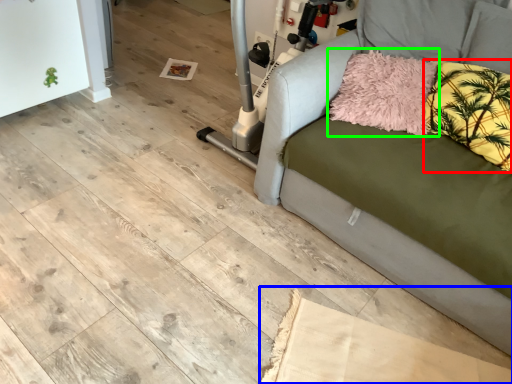
Question: Which is farther away from pillow (highlighted by a red box)? cardboard (highlighted by a blue box) or pillow (highlighted by a green box)?

Choices:
 (A) cardboard
 (B) pillow

Answer: (A)